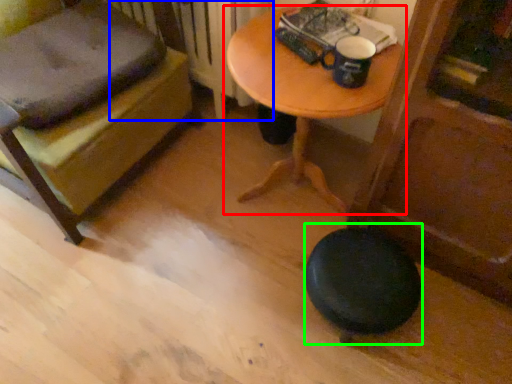
Question: Estimate the real-world distances between objects in this image. Which object is farther from table (highlighted by a red box), radiator (highlighted by a blue box) or stool (highlighted by a green box)?

Choices:
 (A) radiator
 (B) stool

Answer: (B)